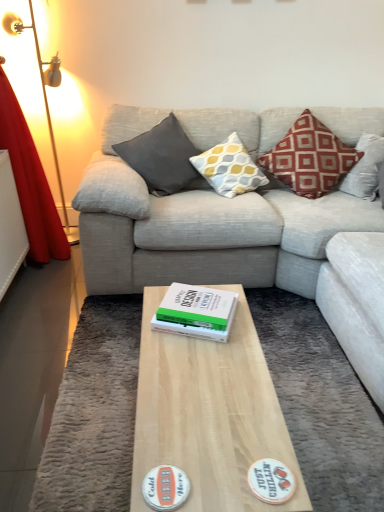
This screenshot has height=512, width=384. What are the coordinates of `vacant space situated on the left part of light wood coffee table at center` in the screenshot? It's located at (93, 428).